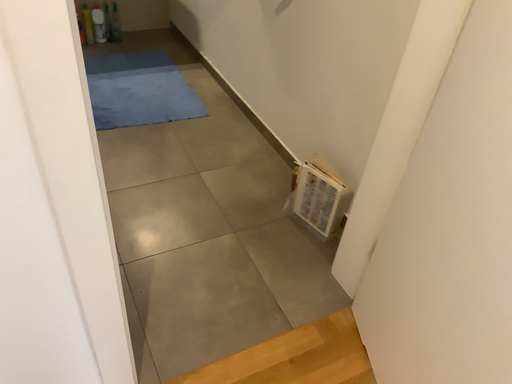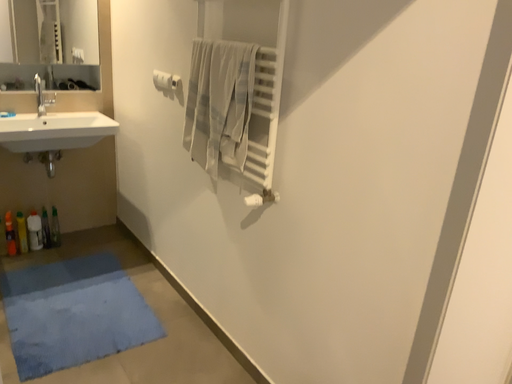
Question: How did the camera likely rotate when shooting the video?

Choices:
 (A) rotated downward
 (B) rotated upward

Answer: (B)